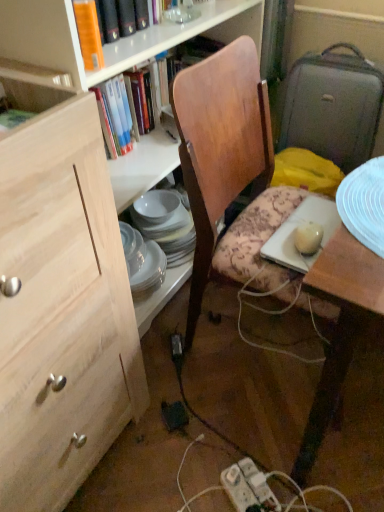
What is the approximate height of wooden desk at right?

wooden desk at right is 29.70 inches tall.

What do you see at coordinates (89, 34) in the screenshot?
I see `orange matte book at upper left, positioned as the 2th book in bottom-to-top order` at bounding box center [89, 34].

This screenshot has width=384, height=512. What do you see at coordinates (107, 40) in the screenshot?
I see `orange hardcover book at upper left, the 1th book from the top` at bounding box center [107, 40].

In order to face wooden chair at center, should I rotate leftwards or rightwards?

Rotate your view right by about 14.262°.

The image size is (384, 512). What do you see at coordinates (13, 119) in the screenshot?
I see `green matte book at upper left, which is the third book from back to front` at bounding box center [13, 119].

Locate an element on the screen. Image resolution: width=384 pixels, height=512 pixels. porcelain plates at center is located at coordinates (159, 238).

Is wooden desk at right in contact with green matte book at upper left, which is the 3th book from top to bottom?

No.

Considering the positions of objects wooden desk at right and green matte book at upper left, which is the 3th book from top to bottom, in the image provided, who is more to the left, wooden desk at right or green matte book at upper left, which is the 3th book from top to bottom,?

Positioned to the left is green matte book at upper left, which is the 3th book from top to bottom.

Considering the sizes of objects wooden desk at right and green matte book at upper left, which is counted as the first book, starting from the front, in the image provided, who is wider, wooden desk at right or green matte book at upper left, which is counted as the first book, starting from the front,?

wooden desk at right is wider.

Based on the photo, is wooden desk at right in front of green matte book at upper left, which is counted as the first book, starting from the front?

That is True.

Measure the distance between porcelain plates at center and black plastic power plugs and sockets at lower center.

porcelain plates at center and black plastic power plugs and sockets at lower center are 55.73 centimeters apart from each other.

The width and height of the screenshot is (384, 512). What are the coordinates of `tableware above the black plastic power plugs and sockets at lower center (from the image's perspective)` in the screenshot? It's located at (159, 238).

What's the angular difference between porcelain plates at center and black plastic power plugs and sockets at lower center's facing directions?

35.2 degrees.

Between porcelain plates at center and black plastic power plugs and sockets at lower center, which one has larger width?

With larger width is porcelain plates at center.

I want to click on desk on the right side of orange matte book at upper left, which is the 2th book from back to front, so click(346, 293).

Which object is further away from the camera taking this photo, orange matte book at upper left, placed as the second book when sorted from front to back, or wooden desk at right?

orange matte book at upper left, placed as the second book when sorted from front to back, is further from the camera.

From the image's perspective, is orange matte book at upper left, acting as the 2th book starting from the top, above or below wooden desk at right?

From the image's perspective, orange matte book at upper left, acting as the 2th book starting from the top, appears above wooden desk at right.

Considering the relative sizes of natural wood cabinet at left and green matte book at upper left, which is counted as the first book, starting from the front, in the image provided, is natural wood cabinet at left shorter than green matte book at upper left, which is counted as the first book, starting from the front,?

No, natural wood cabinet at left is not shorter than green matte book at upper left, which is counted as the first book, starting from the front.

Considering the positions of objects natural wood cabinet at left and green matte book at upper left, which is the first book in bottom-to-top order, in the image provided, who is more to the right, natural wood cabinet at left or green matte book at upper left, which is the first book in bottom-to-top order,?

green matte book at upper left, which is the first book in bottom-to-top order, is more to the right.

Would you say natural wood cabinet at left contains green matte book at upper left, which is counted as the first book, starting from the front?

Indeed, green matte book at upper left, which is counted as the first book, starting from the front, is located within natural wood cabinet at left.

Considering the sizes of objects orange matte book at upper left, acting as the 2th book starting from the top, and green matte book at upper left, which is counted as the first book, starting from the front, in the image provided, who is shorter, orange matte book at upper left, acting as the 2th book starting from the top, or green matte book at upper left, which is counted as the first book, starting from the front,?

With less height is green matte book at upper left, which is counted as the first book, starting from the front.

Is orange matte book at upper left, acting as the 2th book starting from the top, wider or thinner than green matte book at upper left, which is the first book in bottom-to-top order?

orange matte book at upper left, acting as the 2th book starting from the top, is thinner than green matte book at upper left, which is the first book in bottom-to-top order.

Does point (82, 18) appear closer or farther from the camera than point (9, 124)?

Point (82, 18) is positioned farther from the camera compared to point (9, 124).

Is black plastic power plugs and sockets at lower center not inside orange matte book at upper left, placed as the second book when sorted from front to back?

black plastic power plugs and sockets at lower center lies outside orange matte book at upper left, placed as the second book when sorted from front to back,'s area.

From the image's perspective, is black plastic power plugs and sockets at lower center beneath orange matte book at upper left, which is the 2th book from back to front?

Correct, black plastic power plugs and sockets at lower center appears lower than orange matte book at upper left, which is the 2th book from back to front, in the image.

Where is `power plugs and sockets below the orange matte book at upper left, placed as the second book when sorted from front to back (from a real-world perspective)`? power plugs and sockets below the orange matte book at upper left, placed as the second book when sorted from front to back (from a real-world perspective) is located at coordinates (174, 415).

Consider the image. Between black plastic power plugs and sockets at lower center and orange matte book at upper left, positioned as the 2th book in bottom-to-top order, which one is positioned in front?

orange matte book at upper left, positioned as the 2th book in bottom-to-top order, is in front.

I want to click on suitcase to the right of green matte book at upper left, which is counted as the first book, starting from the front, so click(x=333, y=106).

How different are the orientations of gray fabric suitcase at right and green matte book at upper left, which is the third book from back to front, in degrees?

91.3 degrees separate the facing orientations of gray fabric suitcase at right and green matte book at upper left, which is the third book from back to front.

From the picture: Is gray fabric suitcase at right turned away from green matte book at upper left, which is the third book from back to front?

That's not correct — gray fabric suitcase at right is not looking away from green matte book at upper left, which is the third book from back to front.

Does point (325, 145) come behind point (32, 113)?

That is True.

Find the location of a particular element. Image resolution: width=384 pixels, height=512 pixels. desk in front of the green matte book at upper left, which is the 3th book from top to bottom is located at coordinates (346, 293).

You are a GUI agent. You are given a task and a screenshot of the screen. Output one action in this format:
    pyautogui.click(x=<x>, y=<y>)
    Task: Click on the tableware that appears behind the black plastic power plugs and sockets at lower center
    
    Given the screenshot: What is the action you would take?
    pyautogui.click(x=159, y=238)

Based on their spatial positions, is orange hardcover book at upper left, marked as the third book in a bottom-to-top arrangement, or porcelain plates at center further from orange matte book at upper left, placed as the second book when sorted from front to back?

porcelain plates at center is further to orange matte book at upper left, placed as the second book when sorted from front to back.

Looking at the image, which one is located closer to orange matte book at upper left, placed as the second book when sorted from front to back, wooden desk at right or natural wood cabinet at left?

natural wood cabinet at left lies closer to orange matte book at upper left, placed as the second book when sorted from front to back, than the other object.

Considering their positions, is wooden chair at center positioned closer to porcelain plates at center than green matte book at upper left, which is counted as the first book, starting from the front?

Based on the image, wooden chair at center appears to be nearer to porcelain plates at center.

Looking at the image, which one is located closer to orange matte book at upper left, acting as the 2th book starting from the top, orange hardcover book at upper left, the 1th book from the top, or wooden chair at center?

orange hardcover book at upper left, the 1th book from the top, is positioned closer to the anchor orange matte book at upper left, acting as the 2th book starting from the top.

Looking at this image, based on their spatial positions, is black plastic power plugs and sockets at lower center or gray fabric suitcase at right further from orange matte book at upper left, placed as the second book when sorted from front to back?

black plastic power plugs and sockets at lower center is further to orange matte book at upper left, placed as the second book when sorted from front to back.

When comparing their distances from green matte book at upper left, which is the third book from back to front, does orange hardcover book at upper left, the 3th book when ordered from front to back, or black plastic power plugs and sockets at lower center seem further?

Among the two, black plastic power plugs and sockets at lower center is located further to green matte book at upper left, which is the third book from back to front.

Looking at the image, which one is located closer to porcelain plates at center, natural wood cabinet at left or black plastic power plugs and sockets at lower center?

natural wood cabinet at left is closer to porcelain plates at center.

Based on their spatial positions, is black plastic power plugs and sockets at lower center or porcelain plates at center closer to wooden desk at right?

The object closer to wooden desk at right is black plastic power plugs and sockets at lower center.

The height and width of the screenshot is (512, 384). I want to click on book between orange matte book at upper left, positioned as the 2th book in bottom-to-top order, and natural wood cabinet at left, in the vertical direction, so click(x=13, y=119).

The height and width of the screenshot is (512, 384). I want to click on chair between orange matte book at upper left, which is the 2th book from back to front, and black plastic power plugs and sockets at lower center in the up-down direction, so click(227, 166).

Where is `chair between wooden desk at right and gray fabric suitcase at right in the front-back direction`? chair between wooden desk at right and gray fabric suitcase at right in the front-back direction is located at coordinates (227, 166).

This screenshot has height=512, width=384. What are the coordinates of `suitcase between orange hardcover book at upper left, marked as the third book in a bottom-to-top arrangement, and wooden desk at right, in the horizontal direction` in the screenshot? It's located at point(333,106).